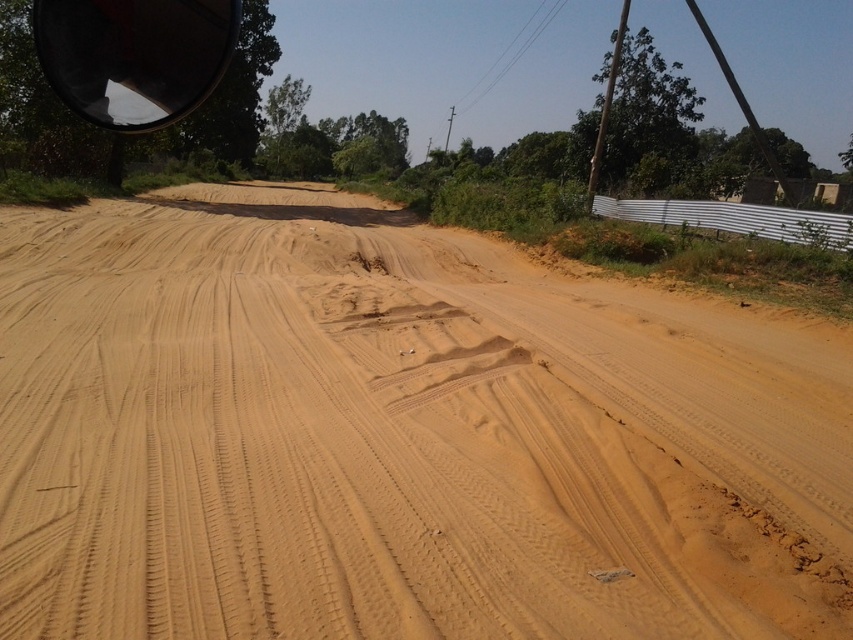
Question: Which point is closer to the camera?

Choices:
 (A) brown sandy dirt at center
 (B) black reflective view mirror at upper left

Answer: (A)

Question: Can you confirm if brown sandy dirt at center is positioned to the right of black reflective view mirror at upper left?

Choices:
 (A) no
 (B) yes

Answer: (B)

Question: Does brown sandy dirt at center appear on the left side of black reflective view mirror at upper left?

Choices:
 (A) yes
 (B) no

Answer: (B)

Question: Which object appears closest to the camera in this image?

Choices:
 (A) black reflective view mirror at upper left
 (B) brown sandy dirt at center

Answer: (B)

Question: Which point is farther from the camera taking this photo?

Choices:
 (A) (51, 84)
 (B) (323, 531)

Answer: (A)

Question: Is brown sandy dirt at center thinner than black reflective view mirror at upper left?

Choices:
 (A) no
 (B) yes

Answer: (A)